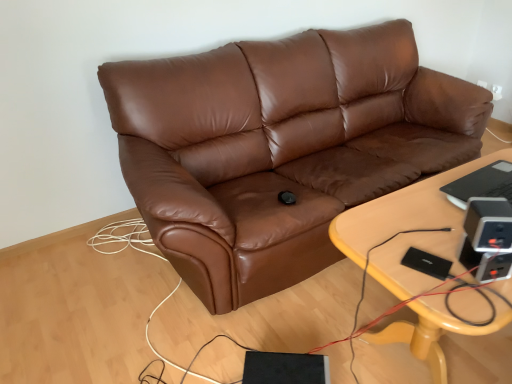
Question: Do you think light wood/yellowishmaterial/texture table at center is within brown leather couch at center, or outside of it?

Choices:
 (A) inside
 (B) outside

Answer: (B)

Question: Does point pos(494,301) appear closer or farther from the camera than point pos(430,132)?

Choices:
 (A) farther
 (B) closer

Answer: (B)

Question: From the image's perspective, relative to brown leather couch at center, is light wood/yellowishmaterial/texture table at center above or below?

Choices:
 (A) above
 (B) below

Answer: (B)

Question: Considering their positions, is brown leather couch at center located in front of or behind light wood/yellowishmaterial/texture table at center?

Choices:
 (A) front
 (B) behind

Answer: (B)

Question: From a real-world perspective, is brown leather couch at center above or below light wood/yellowishmaterial/texture table at center?

Choices:
 (A) below
 (B) above

Answer: (B)

Question: Considering the positions of point (256, 87) and point (406, 332), is point (256, 87) closer or farther from the camera than point (406, 332)?

Choices:
 (A) closer
 (B) farther

Answer: (B)

Question: Visually, is brown leather couch at center positioned to the left or to the right of light wood/yellowishmaterial/texture table at center?

Choices:
 (A) left
 (B) right

Answer: (A)